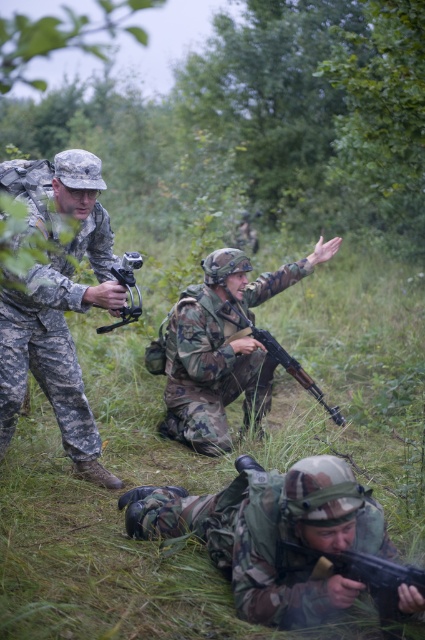
Question: Can you confirm if camouflage uniform at left is bigger than camouflage-patterned rifle at center?

Choices:
 (A) no
 (B) yes

Answer: (B)

Question: Does camouflage uniform at left appear on the right side of camouflage fabric rifle at center?

Choices:
 (A) yes
 (B) no

Answer: (B)

Question: Which point is farther from the camera taking this photo?

Choices:
 (A) (212, 531)
 (B) (238, 280)

Answer: (B)

Question: Which point is farther from the camera taking this photo?

Choices:
 (A) (240, 513)
 (B) (28, 563)
 (C) (278, 349)

Answer: (C)

Question: Does camouflage-patterned rifle at center have a greater width compared to matte black pistol at center?

Choices:
 (A) no
 (B) yes

Answer: (B)

Question: Which point is farther to the camera?

Choices:
 (A) camouflage fabric rifle at lower center
 (B) green grass at center
 (C) camouflage-patterned rifle at center

Answer: (C)